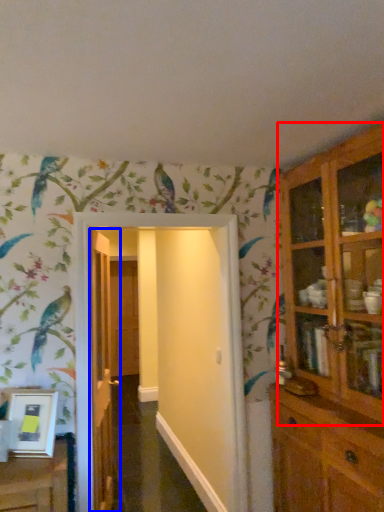
Question: Which object appears closest to the camera in this image, cupboard (highlighted by a red box) or door (highlighted by a blue box)?

Choices:
 (A) cupboard
 (B) door

Answer: (A)